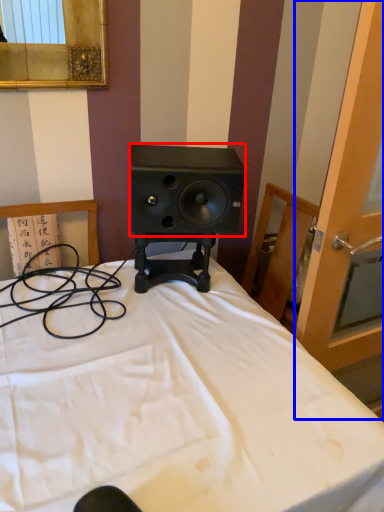
Question: Among these objects, which one is nearest to the camera, speaker (highlighted by a red box) or screen door (highlighted by a blue box)?

Choices:
 (A) speaker
 (B) screen door

Answer: (B)